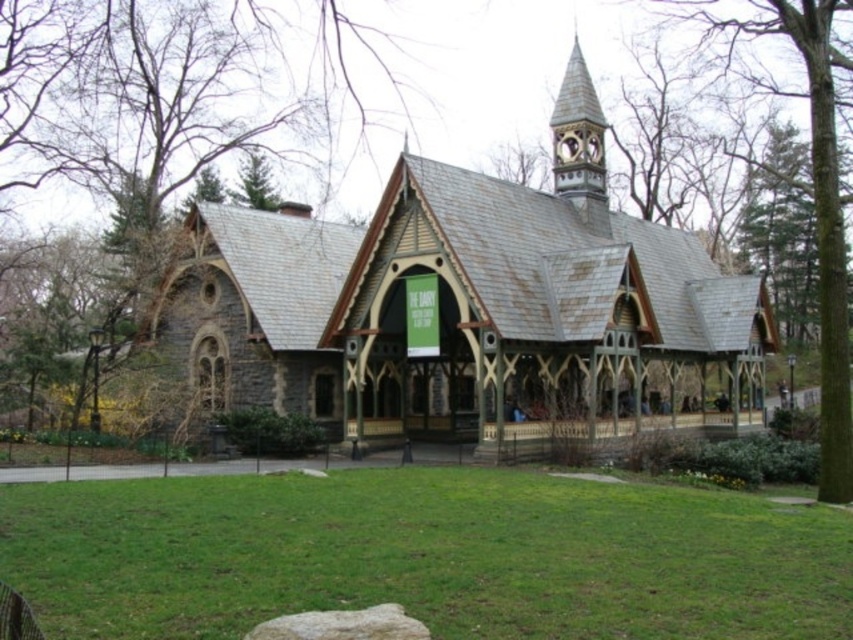
You are standing in front of the Gothic Revival building and see a point marked at coordinates (125, 97). Based on the scene description, where is this point located?

The point is located on the green leafy tree at upper left.

You are standing in the park and see the Gothic Revival building. Which object, the green grass at center or the green shingles roof at upper center, takes up more visual space in the image?

The green shingles roof at upper center takes up more visual space because the green grass at center has a smaller size compared to it.

You are standing at the center of the park and looking at the Gothic Revival building. Where is the green leafy tree at upper left located in relation to the building?

The green leafy tree at upper left is located at the upper left area of the building.